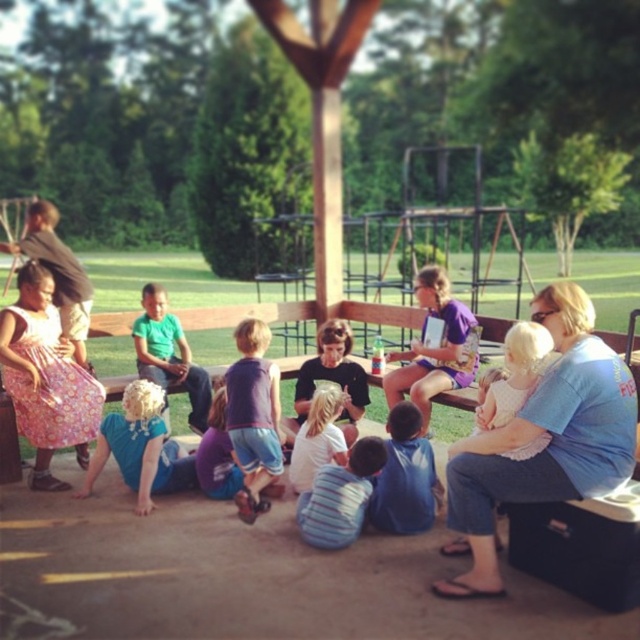
Is purple fabric shorts at center wider than white lace dress at center?

Yes, purple fabric shorts at center is wider than white lace dress at center.

Does purple fabric shorts at center lie in front of white lace dress at center?

That is False.

Is point (268, 371) less distant than point (477, 433)?

No, (268, 371) is further to viewer.

Where is `purple fabric shorts at center`? The width and height of the screenshot is (640, 640). purple fabric shorts at center is located at coordinates (253, 416).

Between blue fabric shirt at lower left and matte black shirt at center, which one appears on the left side from the viewer's perspective?

Positioned to the left is blue fabric shirt at lower left.

This screenshot has height=640, width=640. What do you see at coordinates (140, 448) in the screenshot? I see `blue fabric shirt at lower left` at bounding box center [140, 448].

Who is more forward, (144,396) or (348,417)?

Point (144,396) is in front.

The width and height of the screenshot is (640, 640). I want to click on blue fabric shirt at lower left, so click(x=140, y=448).

Measure the distance between blue denim shirt at lower center and green matte shirt at center.

blue denim shirt at lower center and green matte shirt at center are 6.06 feet apart from each other.

Between point (388, 490) and point (150, 326), which one is positioned behind?

The point (150, 326) is behind.

Image resolution: width=640 pixels, height=640 pixels. What are the coordinates of `blue denim shirt at lower center` in the screenshot? It's located at (404, 477).

Locate an element on the screen. The height and width of the screenshot is (640, 640). blue denim shirt at lower center is located at coordinates (404, 477).